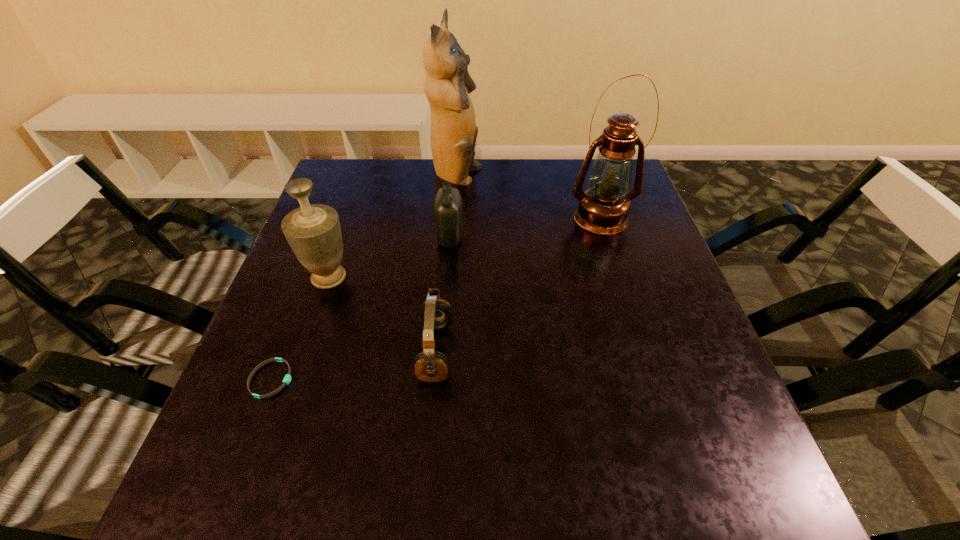
This screenshot has width=960, height=540. Identify the location of free spot between the cat and the urn. (393, 227).

Locate an element on the screen. empty location between the shortest object and the third shortest object is located at coordinates (361, 308).

Locate an element on the screen. vacant space in between the third shortest object and the third tallest object is located at coordinates (390, 258).

Locate an element on the screen. The image size is (960, 540). vacant area between the oil lamp and the headset is located at coordinates (518, 285).

In order to click on the fifth closest object relative to the wristband in this screenshot , I will do `click(603, 208)`.

Locate which object ranks in proximity to the fourth tallest object. Please provide its 2D coordinates. Your answer should be formatted as a tuple, i.e. [(x, y)], where the tuple contains the x and y coordinates of a point satisfying the conditions above.

[(453, 133)]

The height and width of the screenshot is (540, 960). I want to click on vacant area in the image that satisfies the following two spatial constraints: 1. on the back side of the oil lamp; 2. on the right side of the bottle, so click(x=451, y=217).